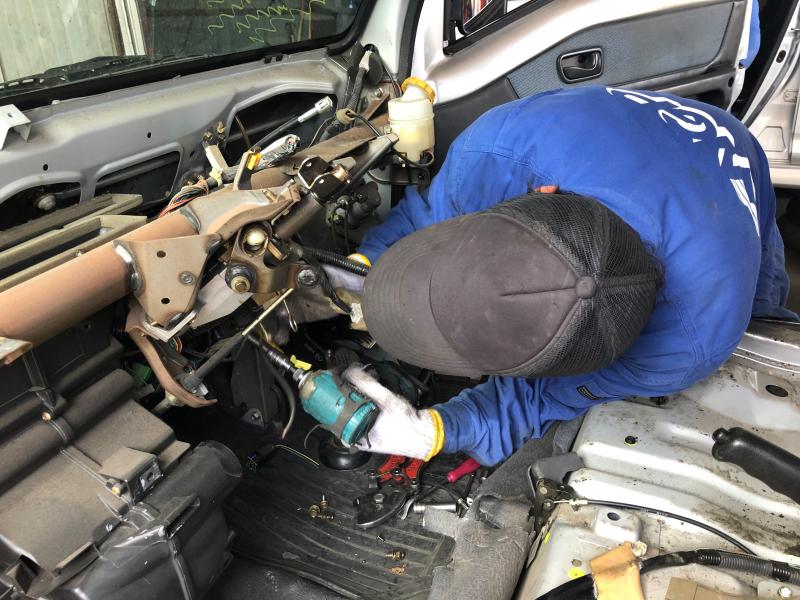
Locate an element on the screen. door handle is located at coordinates [x=577, y=72].